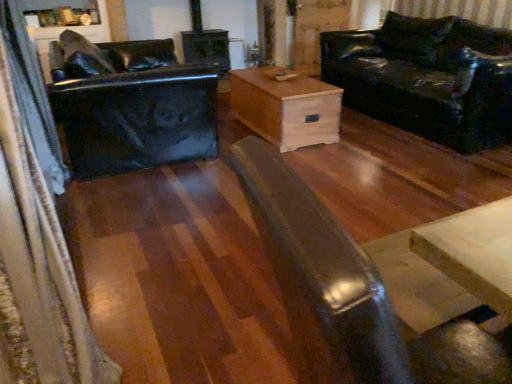
Question: From the image's perspective, is glossy black swivel chair at left beneath natural wood chest at center?

Choices:
 (A) yes
 (B) no

Answer: (B)

Question: From a real-world perspective, is glossy black swivel chair at left located higher than natural wood chest at center?

Choices:
 (A) no
 (B) yes

Answer: (B)

Question: Considering the relative sizes of glossy black swivel chair at left and natural wood chest at center in the image provided, is glossy black swivel chair at left thinner than natural wood chest at center?

Choices:
 (A) no
 (B) yes

Answer: (A)

Question: From the image's perspective, is glossy black swivel chair at left on natural wood chest at center?

Choices:
 (A) yes
 (B) no

Answer: (A)

Question: Is glossy black swivel chair at left located outside natural wood chest at center?

Choices:
 (A) no
 (B) yes

Answer: (B)

Question: Is glossy black swivel chair at left at the left side of natural wood chest at center?

Choices:
 (A) no
 (B) yes

Answer: (B)

Question: Does natural wood chest at center appear on the left side of shiny black leather couch at right?

Choices:
 (A) yes
 (B) no

Answer: (A)

Question: Does natural wood chest at center have a larger size compared to shiny black leather couch at right?

Choices:
 (A) yes
 (B) no

Answer: (B)

Question: Is natural wood chest at center not within shiny black leather couch at right?

Choices:
 (A) no
 (B) yes

Answer: (B)

Question: Is natural wood chest at center oriented towards shiny black leather couch at right?

Choices:
 (A) yes
 (B) no

Answer: (B)

Question: Does natural wood chest at center appear on the right side of shiny black leather couch at right?

Choices:
 (A) yes
 (B) no

Answer: (B)

Question: From a real-world perspective, is natural wood chest at center under shiny black leather couch at right?

Choices:
 (A) yes
 (B) no

Answer: (A)

Question: Is glossy black swivel chair at left closer to the viewer compared to matte black coffee table at center?

Choices:
 (A) no
 (B) yes

Answer: (A)